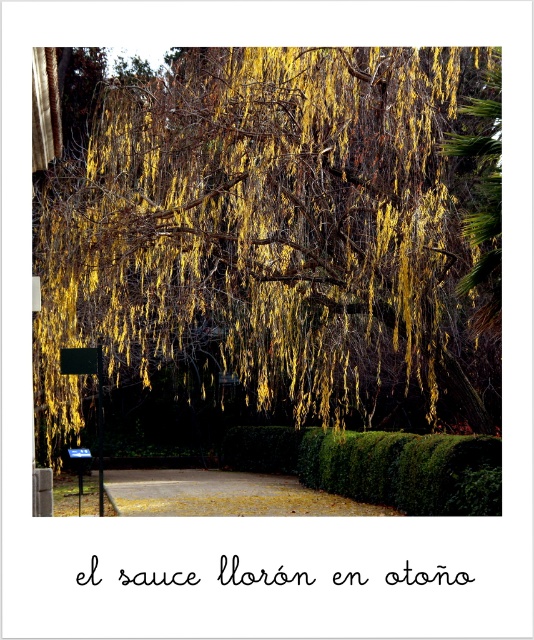
Question: Does yellow-green silky leaves at upper center appear on the right side of green leafy hedge at center?

Choices:
 (A) no
 (B) yes

Answer: (A)

Question: Which of the following is the farthest from the observer?

Choices:
 (A) (78, 460)
 (B) (366, 492)
 (C) (414, 360)

Answer: (A)

Question: Among these points, which one is nearest to the camera?

Choices:
 (A) (490, 444)
 (B) (131, 104)
 (C) (81, 490)

Answer: (A)

Question: Where is yellow-green silky leaves at upper center located in relation to green leafy hedge at center in the image?

Choices:
 (A) above
 (B) below

Answer: (A)

Question: Can you confirm if yellow-green silky leaves at upper center is positioned above blue plastic sign at lower left?

Choices:
 (A) no
 (B) yes

Answer: (B)

Question: Which of the following is the farthest from the observer?

Choices:
 (A) yellow-green silky leaves at upper center
 (B) blue plastic sign at lower left
 (C) green leafy hedge at center

Answer: (B)